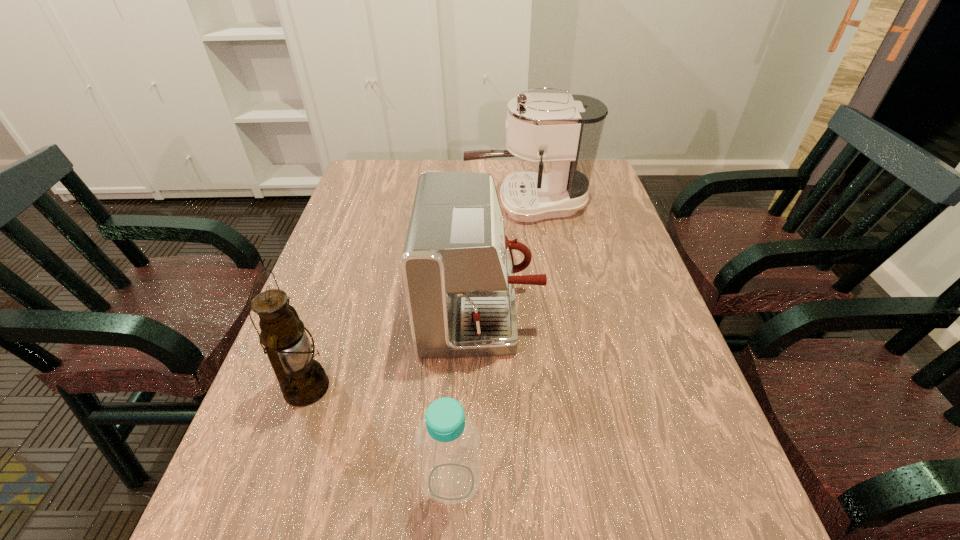
At what (x,y) coordinates should I click in order to perform the action: click on vacant point located between the nearer coffee maker and the shortest object. Please return your answer as a coordinate pair (x, y). Looking at the image, I should click on (466, 396).

Find the location of a particular element. empty space between the nearest object and the oil lamp is located at coordinates (379, 434).

You are a GUI agent. You are given a task and a screenshot of the screen. Output one action in this format:
    pyautogui.click(x=<x>, y=<y>)
    Task: Click on the unoccupied area between the bottle and the nearer coffee maker
    The height and width of the screenshot is (540, 960).
    Given the screenshot: What is the action you would take?
    pos(466,396)

Where is `vacant point located between the shortest object and the shorter coffee maker`? The height and width of the screenshot is (540, 960). vacant point located between the shortest object and the shorter coffee maker is located at coordinates (466, 396).

What are the coordinates of `vacant space that is in between the nearest object and the nearer coffee maker` in the screenshot? It's located at (466, 396).

Identify which object is the second nearest to the farther coffee maker. Please provide its 2D coordinates. Your answer should be formatted as a tuple, i.e. [(x, y)], where the tuple contains the x and y coordinates of a point satisfying the conditions above.

[(303, 381)]

Identify the location of object identified as the third closest to the oil lamp. The width and height of the screenshot is (960, 540). (564, 130).